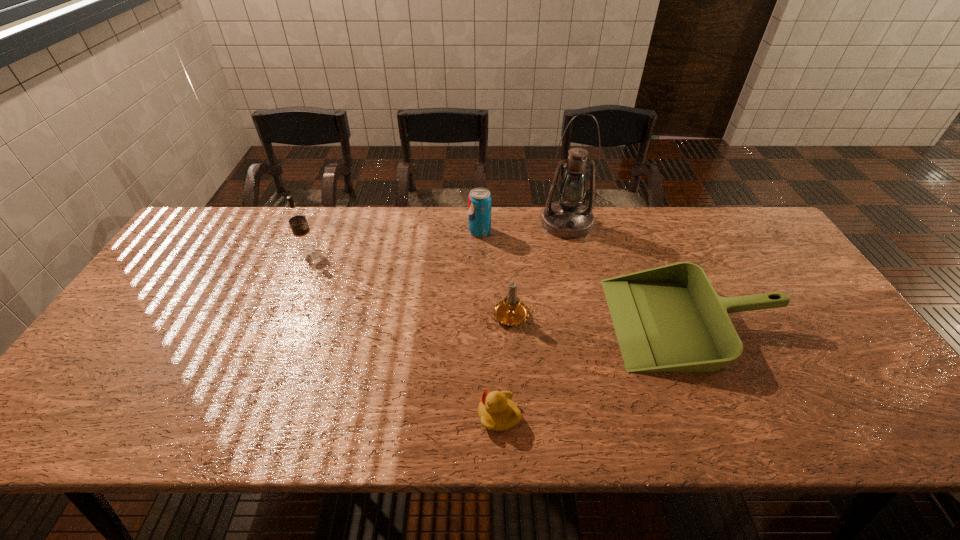
Locate an element on the screen. The width and height of the screenshot is (960, 540). free space between the soda can and the fourth tallest object is located at coordinates (497, 273).

Where is `blank region between the duckling and the vodka`? The image size is (960, 540). blank region between the duckling and the vodka is located at coordinates (403, 332).

Locate an element on the screen. The image size is (960, 540). vacant region between the fifth tallest object and the candle is located at coordinates (604, 319).

Image resolution: width=960 pixels, height=540 pixels. I want to click on free point between the soda can and the candle, so click(497, 273).

Identify the location of free point between the candle and the nearest object. Image resolution: width=960 pixels, height=540 pixels. (507, 366).

The width and height of the screenshot is (960, 540). In order to click on free space between the dustpan and the leftmost object in this screenshot , I will do `click(500, 285)`.

The width and height of the screenshot is (960, 540). I want to click on vacant space in between the duckling and the second tallest object, so click(x=403, y=332).

Identify which object is the fifth closest to the shortest object. Please provide its 2D coordinates. Your answer should be formatted as a tuple, i.e. [(x, y)], where the tuple contains the x and y coordinates of a point satisfying the conditions above.

[(296, 217)]

Locate which object is the fourth closest to the third farthest object. Please provide its 2D coordinates. Your answer should be formatted as a tuple, i.e. [(x, y)], where the tuple contains the x and y coordinates of a point satisfying the conditions above.

[(568, 218)]

Locate an element on the screen. The image size is (960, 540). free space that satisfies the following two spatial constraints: 1. on the label of the vodka; 2. on the left side of the third shortest object is located at coordinates (278, 315).